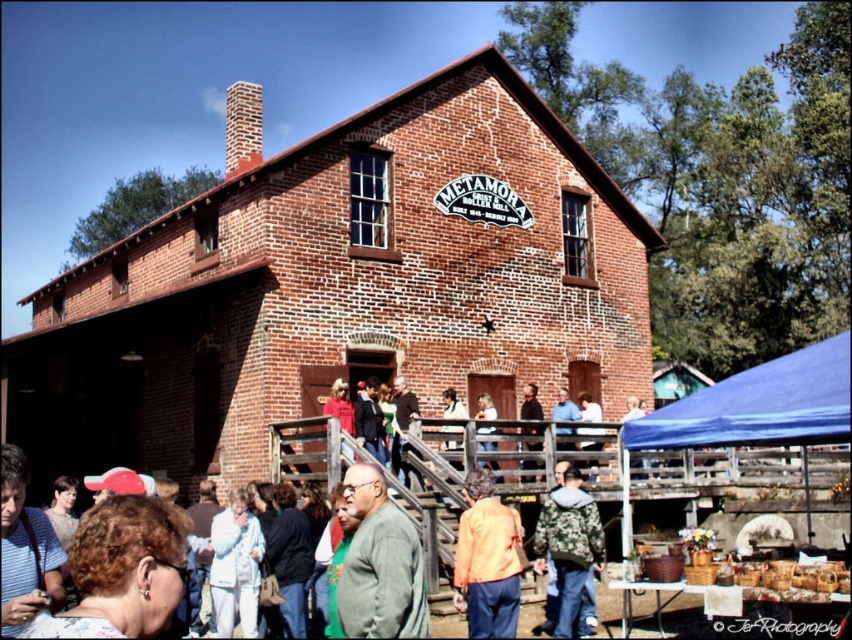
Question: Among these objects, which one is farthest from the camera?

Choices:
 (A) orange fabric jacket at center
 (B) camouflage jacket at lower center

Answer: (B)

Question: Which object is closer to the camera taking this photo?

Choices:
 (A) green fuzzy sweater at center
 (B) camouflage jacket at lower center
 (C) orange fabric jacket at center

Answer: (A)

Question: Which is farther from the green fuzzy sweater at center?

Choices:
 (A) camouflage jacket at lower center
 (B) orange fabric jacket at center

Answer: (A)

Question: Is green fuzzy sweater at center to the left of orange fabric jacket at center from the viewer's perspective?

Choices:
 (A) no
 (B) yes

Answer: (B)

Question: Is orange fabric jacket at center bigger than camouflage jacket at lower center?

Choices:
 (A) no
 (B) yes

Answer: (B)

Question: Does green fuzzy sweater at center have a lesser width compared to orange fabric jacket at center?

Choices:
 (A) yes
 (B) no

Answer: (A)